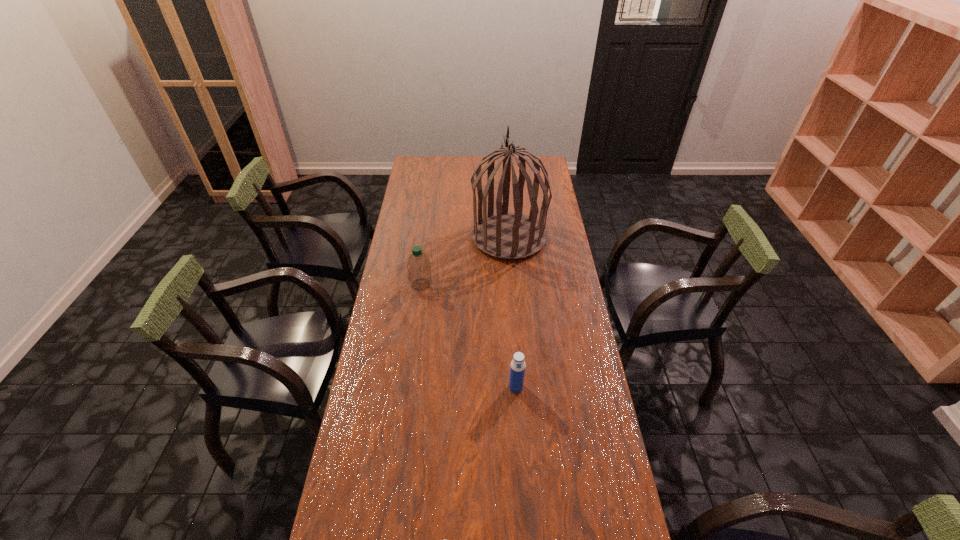
Image resolution: width=960 pixels, height=540 pixels. I want to click on object situated at the right edge, so click(508, 235).

Identify the location of free location at the far edge of the desktop. This screenshot has height=540, width=960. (444, 165).

In the image, there is a desktop. At what (x,y) coordinates should I click in order to perform the action: click on free space at the left edge. Please return your answer as a coordinate pair (x, y). Image resolution: width=960 pixels, height=540 pixels. Looking at the image, I should click on (405, 446).

In the image, there is a desktop. Where is `vacant space at the right edge`? vacant space at the right edge is located at coordinates (569, 287).

The height and width of the screenshot is (540, 960). In the image, there is a desktop. What are the coordinates of `vacant space at the far left corner` in the screenshot? It's located at (437, 165).

This screenshot has width=960, height=540. I want to click on free point between the third nearest object and the rightmost water bottle, so click(x=468, y=336).

Where is `vacant region between the second farthest object and the rightmost water bottle`? This screenshot has width=960, height=540. vacant region between the second farthest object and the rightmost water bottle is located at coordinates (468, 336).

Locate an element on the screen. Image resolution: width=960 pixels, height=540 pixels. free point between the second farthest water bottle and the tallest object is located at coordinates (513, 312).

Locate an element on the screen. Image resolution: width=960 pixels, height=540 pixels. free space between the farthest object and the leftmost water bottle is located at coordinates (x=465, y=261).

Locate which object is the third closest to the second farthest water bottle. Please provide its 2D coordinates. Your answer should be formatted as a tuple, i.e. [(x, y)], where the tuple contains the x and y coordinates of a point satisfying the conditions above.

[(508, 235)]